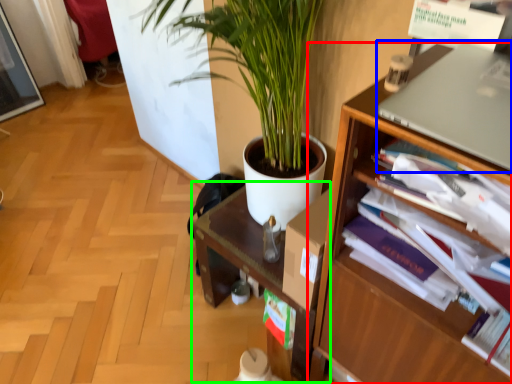
Question: Which object is positioned closest to shelf (highlighted by a red box)? Select from computer (highlighted by a blue box) and computer desk (highlighted by a green box).

Choices:
 (A) computer
 (B) computer desk

Answer: (A)